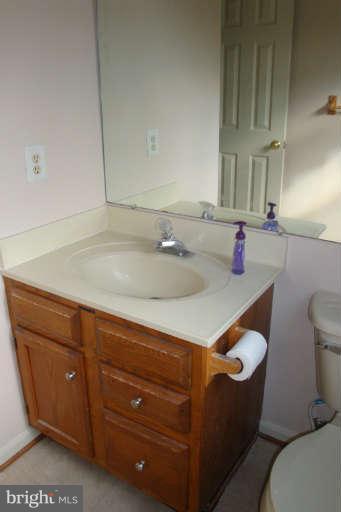
This screenshot has height=512, width=341. In order to click on knob in this screenshot , I will do `click(70, 375)`, `click(134, 403)`, `click(138, 468)`, `click(274, 142)`.